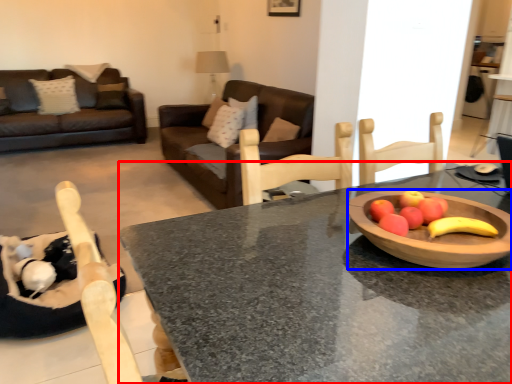
Question: Which point is closer to the camera, desk (highlighted by a red box) or bowl (highlighted by a blue box)?

Choices:
 (A) desk
 (B) bowl

Answer: (A)